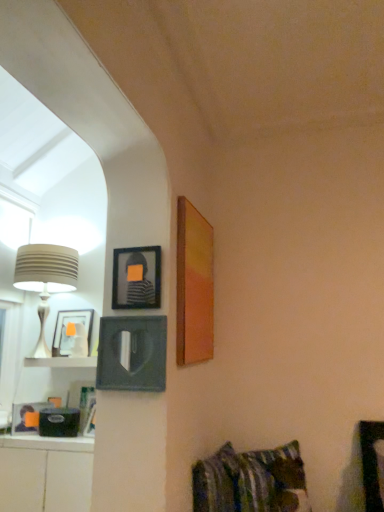
Describe the element at coordinates (250, 481) in the screenshot. I see `striped fabric pillow at lower right` at that location.

What do you see at coordinates (61, 362) in the screenshot? I see `white matte shelf at lower left` at bounding box center [61, 362].

I want to click on matte black picture frame at left, which is the 1th picture frame from left to right, so click(x=66, y=330).

In order to face matte black picture frame at upper center, the 2th picture frame positioned from the left, should I rotate leftwards or rightwards?

Turn left by 7.447 degrees to look at matte black picture frame at upper center, the 2th picture frame positioned from the left.

Where is `white glossy cabinet at lower left`? white glossy cabinet at lower left is located at coordinates (45, 474).

Which object is more forward, white matte shelf at lower left or striped fabric pillow at lower right?

striped fabric pillow at lower right.

Is white matte shelf at lower left taller or shorter than striped fabric pillow at lower right?

In the image, white matte shelf at lower left appears to be shorter than striped fabric pillow at lower right.

How far apart are white matte shelf at lower left and striped fabric pillow at lower right?

white matte shelf at lower left is 3.33 feet from striped fabric pillow at lower right.

Is point (65, 362) closer or farther from the camera than point (77, 441)?

Point (65, 362) is positioned farther from the camera compared to point (77, 441).

How distant is white matte shelf at lower left from white glossy cabinet at lower left?

white matte shelf at lower left and white glossy cabinet at lower left are 52.55 centimeters apart from each other.

From a real-world perspective, between white matte shelf at lower left and white glossy cabinet at lower left, who is vertically higher?

white matte shelf at lower left, from a real-world perspective.

Find the location of a particular element. The width and height of the screenshot is (384, 512). cabinetry located on the left of white matte shelf at lower left is located at coordinates (45, 474).

Image resolution: width=384 pixels, height=512 pixels. What are the coordinates of `bed below the matte black picture frame at upper center, the 2th picture frame positioned from the left (from a real-world perspective)` in the screenshot? It's located at (250, 481).

Is matte black picture frame at upper center, positioned as the 2th picture frame in right-to-left order, positioned with its back to striped fabric pillow at lower right?

No, striped fabric pillow at lower right is not at the back of matte black picture frame at upper center, positioned as the 2th picture frame in right-to-left order.

Is point (141, 252) closer or farther from the camera than point (267, 495)?

Point (141, 252).

Do you think matte black picture frame at upper center, the 2th picture frame positioned from the left, is within striped fabric pillow at lower right, or outside of it?

matte black picture frame at upper center, the 2th picture frame positioned from the left, is not inside striped fabric pillow at lower right, it's outside.

Which of these two, striped fabric pillow at lower right or striped fabric pillow at lower right, is smaller?

striped fabric pillow at lower right is smaller.

Which is more to the right, striped fabric pillow at lower right or striped fabric pillow at lower right?

striped fabric pillow at lower right.

Measure the distance between striped fabric pillow at lower right and striped fabric pillow at lower right.

striped fabric pillow at lower right and striped fabric pillow at lower right are 8.01 centimeters apart.

Is striped fabric pillow at lower right not near striped fabric pillow at lower right?

striped fabric pillow at lower right is near striped fabric pillow at lower right, not far away.

Is matte black picture frame at left, which is the 1th picture frame from left to right, completely or partially outside of beige ribbed lampshade at left?

Actually, matte black picture frame at left, which is the 1th picture frame from left to right, is at least partially inside beige ribbed lampshade at left.

Is matte black picture frame at left, which is the 1th picture frame from left to right, thinner than beige ribbed lampshade at left?

Correct, the width of matte black picture frame at left, which is the 1th picture frame from left to right, is less than that of beige ribbed lampshade at left.

Can you confirm if matte black picture frame at left, which appears as the third picture frame when viewed from the right, is shorter than beige ribbed lampshade at left?

Correct, matte black picture frame at left, which appears as the third picture frame when viewed from the right, is not as tall as beige ribbed lampshade at left.

Is matte black picture frame at left, which is the 1th picture frame from left to right, to the left or to the right of beige ribbed lampshade at left in the image?

matte black picture frame at left, which is the 1th picture frame from left to right, is positioned on beige ribbed lampshade at left's right side.

From the image's perspective, who appears lower, matte wooden picture frame at upper right, which is counted as the 3th picture frame, starting from the left, or beige ribbed lampshade at left?

From the image's view, beige ribbed lampshade at left is below.

Between point (205, 236) and point (33, 259), which one is positioned behind?

Point (33, 259)

Is matte wooden picture frame at upper right, which ranks as the 1th picture frame in right-to-left order, to the right of beige ribbed lampshade at left from the viewer's perspective?

Indeed, matte wooden picture frame at upper right, which ranks as the 1th picture frame in right-to-left order, is positioned on the right side of beige ribbed lampshade at left.

Between matte wooden picture frame at upper right, which ranks as the 1th picture frame in right-to-left order, and beige ribbed lampshade at left, which one has more height?

matte wooden picture frame at upper right, which ranks as the 1th picture frame in right-to-left order, is taller.

At what (x,y) coordinates should I click in order to perform the action: click on cabinetry that is below the matte black picture frame at left, which is the 1th picture frame from left to right (from the image's perspective). Please return your answer as a coordinate pair (x, y). Looking at the image, I should click on (45, 474).

Which object is thinner, matte black picture frame at left, which appears as the third picture frame when viewed from the right, or white glossy cabinet at lower left?

matte black picture frame at left, which appears as the third picture frame when viewed from the right.

From a real-world perspective, relative to white glossy cabinet at lower left, is matte black picture frame at left, which appears as the third picture frame when viewed from the right, vertically above or below?

From a real-world perspective, matte black picture frame at left, which appears as the third picture frame when viewed from the right, is physically above white glossy cabinet at lower left.

Based on their positions, is matte black picture frame at left, which is the 1th picture frame from left to right, located to the left or right of white glossy cabinet at lower left?

matte black picture frame at left, which is the 1th picture frame from left to right, is to the right of white glossy cabinet at lower left.

Locate an element on the screen. shelf above the striped fabric pillow at lower right (from the image's perspective) is located at coordinates (61, 362).

Where is `cabinetry below the white matte shelf at lower left (from a real-world perspective)`? cabinetry below the white matte shelf at lower left (from a real-world perspective) is located at coordinates (45, 474).

Looking at the image, which one is located further to matte black picture frame at upper center, the 2th picture frame positioned from the left, matte black picture frame at left, which is the 1th picture frame from left to right, or striped fabric pillow at lower right?

Among the two, striped fabric pillow at lower right is located further to matte black picture frame at upper center, the 2th picture frame positioned from the left.

Looking at the image, which one is located closer to striped fabric pillow at lower right, matte black picture frame at left, which is the 1th picture frame from left to right, or matte wooden picture frame at upper right, which is counted as the 3th picture frame, starting from the left?

matte wooden picture frame at upper right, which is counted as the 3th picture frame, starting from the left, is closer to striped fabric pillow at lower right.

When comparing their distances from striped fabric pillow at lower right, does matte black picture frame at upper center, the 2th picture frame positioned from the left, or striped fabric pillow at lower right seem further?

matte black picture frame at upper center, the 2th picture frame positioned from the left.

From the image, which object appears to be nearer to white matte shelf at lower left, matte black picture frame at upper center, the 2th picture frame positioned from the left, or matte black picture frame at left, which appears as the third picture frame when viewed from the right?

matte black picture frame at left, which appears as the third picture frame when viewed from the right, lies closer to white matte shelf at lower left than the other object.

Considering their positions, is white matte shelf at lower left positioned closer to striped fabric pillow at lower right than matte wooden picture frame at upper right, which ranks as the 1th picture frame in right-to-left order?

Based on the image, matte wooden picture frame at upper right, which ranks as the 1th picture frame in right-to-left order, appears to be nearer to striped fabric pillow at lower right.

Considering their positions, is striped fabric pillow at lower right positioned closer to white matte shelf at lower left than matte wooden picture frame at upper right, which ranks as the 1th picture frame in right-to-left order?

matte wooden picture frame at upper right, which ranks as the 1th picture frame in right-to-left order.

Based on their spatial positions, is white matte shelf at lower left or matte black picture frame at left, which appears as the third picture frame when viewed from the right, closer to matte black picture frame at upper center, the 2th picture frame positioned from the left?

Among the two, matte black picture frame at left, which appears as the third picture frame when viewed from the right, is located nearer to matte black picture frame at upper center, the 2th picture frame positioned from the left.

In the scene shown: When comparing their distances from striped fabric pillow at lower right, does matte wooden picture frame at upper right, which ranks as the 1th picture frame in right-to-left order, or matte black picture frame at upper center, positioned as the 2th picture frame in right-to-left order, seem further?

matte black picture frame at upper center, positioned as the 2th picture frame in right-to-left order.

The width and height of the screenshot is (384, 512). What are the coordinates of `picture frame between matte wooden picture frame at upper right, which ranks as the 1th picture frame in right-to-left order, and striped fabric pillow at lower right, in the vertical direction` in the screenshot? It's located at (66, 330).

You are a GUI agent. You are given a task and a screenshot of the screen. Output one action in this format:
    pyautogui.click(x=<x>, y=<y>)
    Task: Click on the bed that lies between matte black picture frame at upper center, the 2th picture frame positioned from the left, and striped fabric pillow at lower right from top to bottom
    
    Given the screenshot: What is the action you would take?
    pyautogui.click(x=250, y=481)

Find the location of a particular element. picture frame that lies between beige ribbed lampshade at left and white matte shelf at lower left from top to bottom is located at coordinates (66, 330).

At what (x,y) coordinates should I click in order to perform the action: click on shelf situated between matte black picture frame at left, which appears as the third picture frame when viewed from the right, and matte wooden picture frame at upper right, which ranks as the 1th picture frame in right-to-left order, from left to right. Please return your answer as a coordinate pair (x, y). The image size is (384, 512). Looking at the image, I should click on (61, 362).